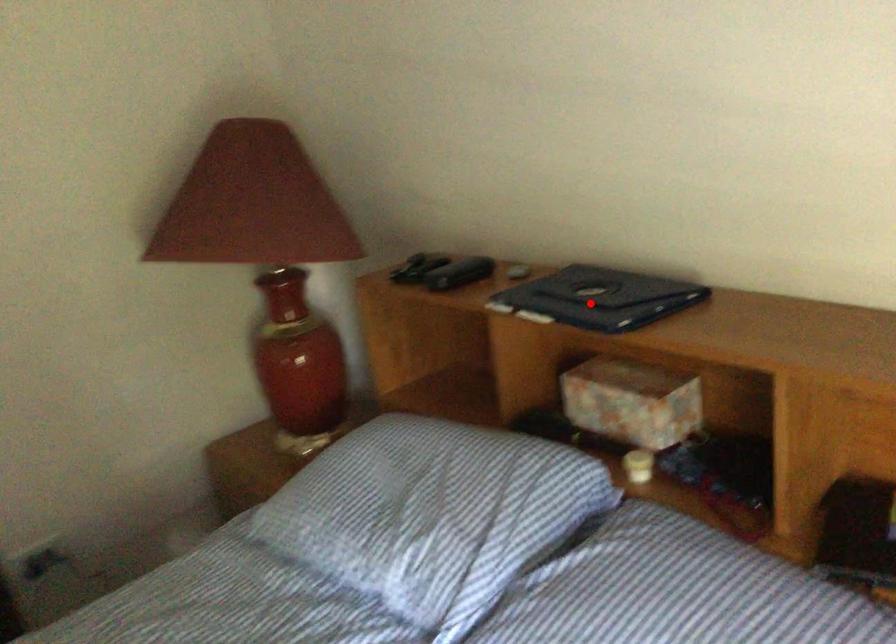
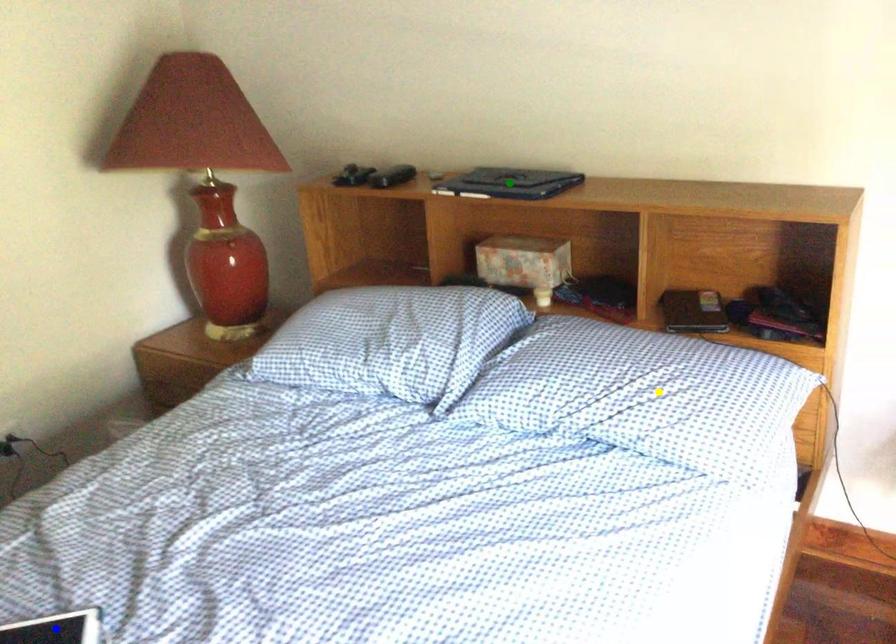
Question: I am providing you with two images of the same scene from different viewpoints. A red point is marked on the first image. You are given multiple points on the second image. Can you choose the point in image 2 that corresponds to the point in image 1?

Choices:
 (A) blue point
 (B) green point
 (C) yellow point

Answer: (B)